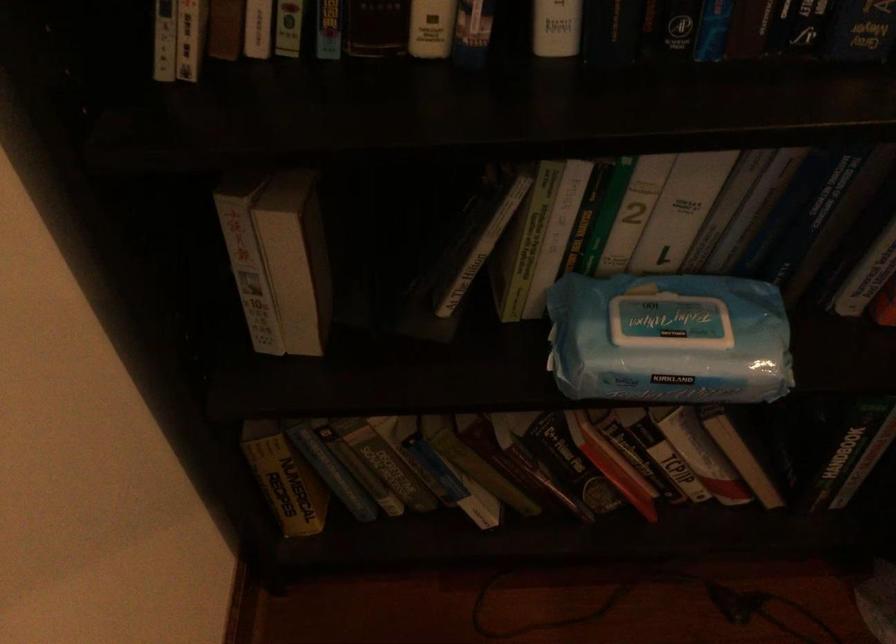
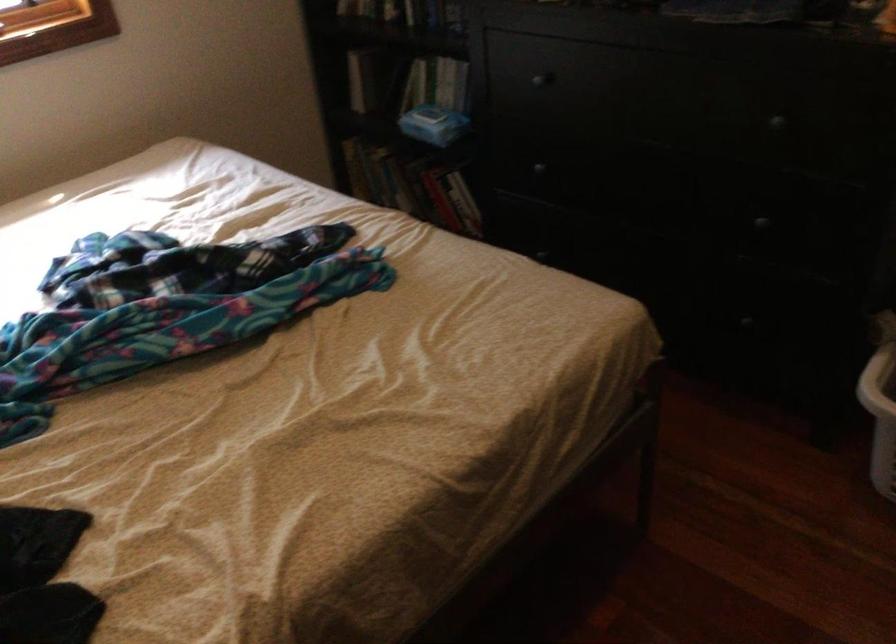
The point at (x=693, y=458) is marked in the first image. Where is the corresponding point in the second image?

(464, 203)